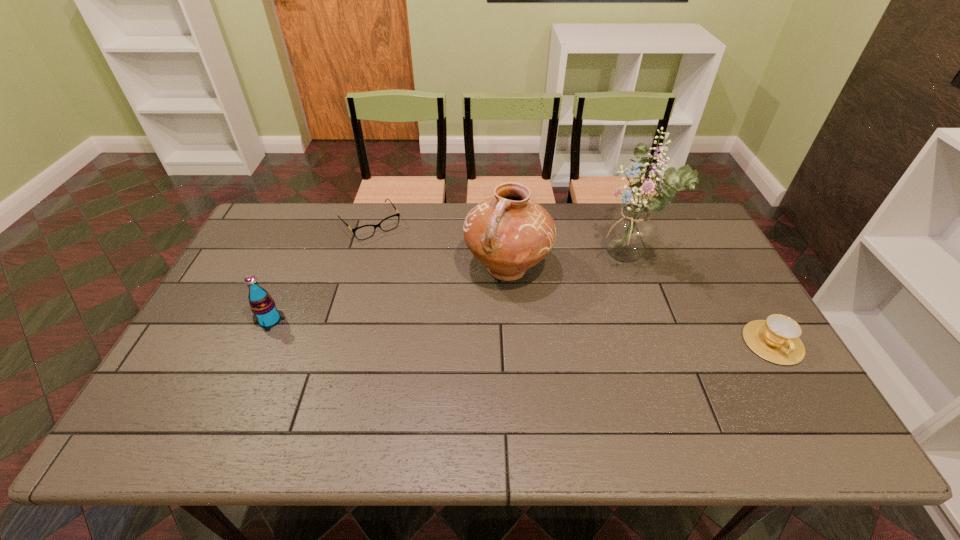
Identify the location of the third shortest object. This screenshot has height=540, width=960. (262, 305).

At what (x,y) coordinates should I click in order to perform the action: click on soda. Please return your answer as a coordinate pair (x, y). Image resolution: width=960 pixels, height=540 pixels. Looking at the image, I should click on (262, 305).

Where is `the rightmost object`? This screenshot has width=960, height=540. the rightmost object is located at coordinates (776, 339).

Image resolution: width=960 pixels, height=540 pixels. I want to click on cup, so click(776, 339).

This screenshot has height=540, width=960. What are the coordinates of `the tallest object` in the screenshot? It's located at (629, 232).

Locate an element on the screen. This screenshot has width=960, height=540. the second object from right to left is located at coordinates (629, 232).

Locate an element on the screen. The width and height of the screenshot is (960, 540). the third object from right to left is located at coordinates (509, 233).

Find the location of a particular element. Image resolution: width=960 pixels, height=540 pixels. the fourth shortest object is located at coordinates (509, 233).

Locate an element on the screen. This screenshot has width=960, height=540. the shortest object is located at coordinates pyautogui.click(x=364, y=232).

Identify the location of the second object from left to right. (364, 232).